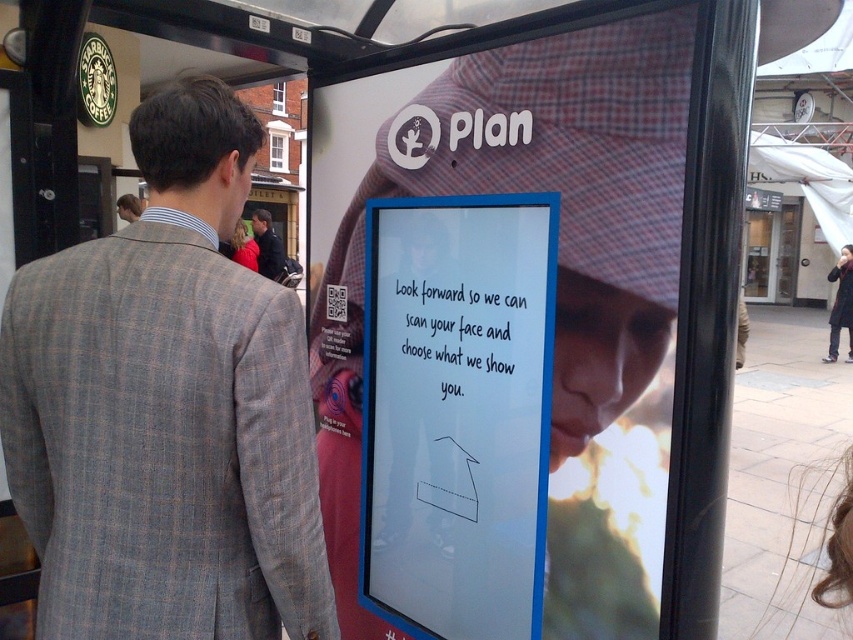
Question: Observing the image, what is the correct spatial positioning of dark blue jacket at center in reference to red fleece jacket at center?

Choices:
 (A) below
 (B) above

Answer: (B)

Question: Does gray checkered suit at left appear on the right side of red fleece jacket at center?

Choices:
 (A) no
 (B) yes

Answer: (B)

Question: Which point is closer to the camera?

Choices:
 (A) (836, 496)
 (B) (241, 246)

Answer: (A)

Question: Which object is closer to the camera taking this photo?

Choices:
 (A) light brown hair at upper left
 (B) gray checkered suit at left

Answer: (B)

Question: Observing the image, what is the correct spatial positioning of red fleece jacket at center in reference to light brown hair at upper left?

Choices:
 (A) left
 (B) right

Answer: (B)

Question: Which of the following is the closest to the observer?

Choices:
 (A) dark blue jacket at center
 (B) gray checkered suit at left

Answer: (B)